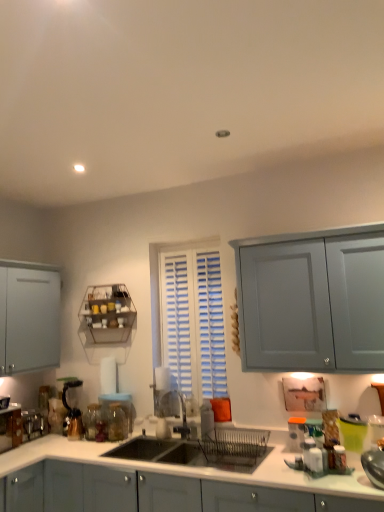
The width and height of the screenshot is (384, 512). Identify the location of vacant space positioned to the left of matte black coffee machine at lower left. (41, 440).